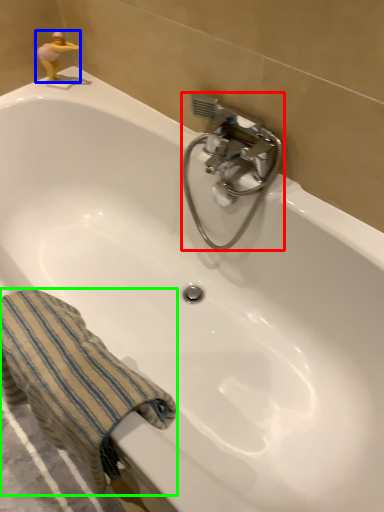
Question: Which object is the farthest from plumbing fixture (highlighted by a red box)? Choose among these: miniature (highlighted by a blue box) or towel/napkin (highlighted by a green box).

Choices:
 (A) miniature
 (B) towel/napkin

Answer: (A)